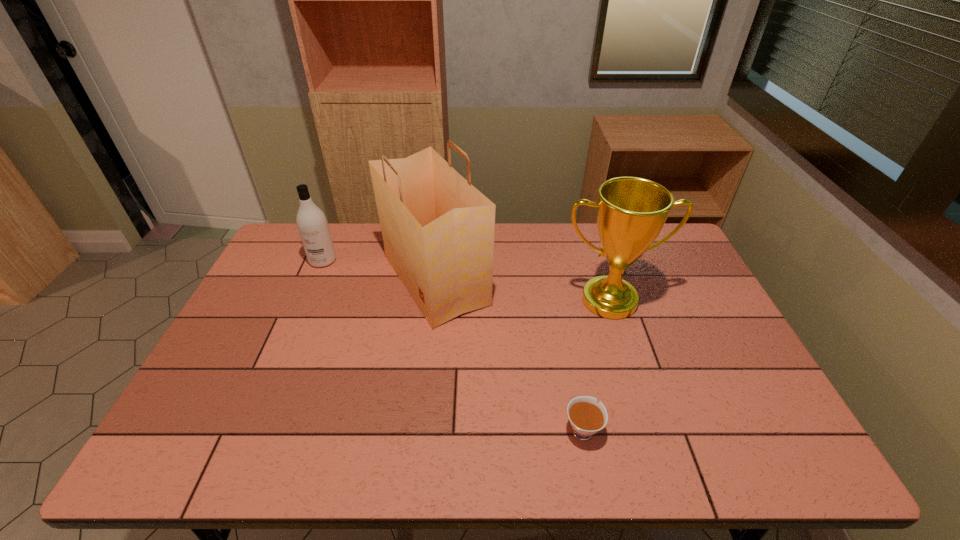
Image resolution: width=960 pixels, height=540 pixels. In the image, there is a desktop. What are the coordinates of `vacant space at the left edge` in the screenshot? It's located at (242, 325).

Where is `free space at the right edge of the desktop`? free space at the right edge of the desktop is located at coordinates (689, 280).

The height and width of the screenshot is (540, 960). In the image, there is a desktop. What are the coordinates of `vacant space at the far right corner` in the screenshot? It's located at [x=676, y=255].

Identify the location of vacant space that is in between the nearest object and the second object from left to right. Image resolution: width=960 pixels, height=540 pixels. (509, 354).

You are a GUI agent. You are given a task and a screenshot of the screen. Output one action in this format:
    pyautogui.click(x=<x>, y=<y>)
    Task: Click on the free point between the grocery bag and the award
    
    Given the screenshot: What is the action you would take?
    pyautogui.click(x=522, y=290)

At what (x,y) coordinates should I click in order to perform the action: click on vacant area that lies between the nearest object and the third shortest object. Please return your answer as a coordinate pair (x, y). The image size is (960, 540). Looking at the image, I should click on (595, 364).

Find the location of `free spot between the shampoo and the shortest object`. free spot between the shampoo and the shortest object is located at coordinates (452, 345).

You are a GUI agent. You are given a task and a screenshot of the screen. Output one action in this format:
    pyautogui.click(x=<x>, y=<y>)
    Task: Click on the free space between the shampoo and the shortest object
    The height and width of the screenshot is (540, 960).
    Given the screenshot: What is the action you would take?
    pyautogui.click(x=452, y=345)

At what (x,y) coordinates should I click in order to perform the action: click on free space between the teacup and the shampoo. Please return your answer as a coordinate pair (x, y). This screenshot has width=960, height=540. Looking at the image, I should click on (452, 345).

Select which object is the closest to the grocery bag. Please provide its 2D coordinates. Your answer should be formatted as a tuple, i.e. [(x, y)], where the tuple contains the x and y coordinates of a point satisfying the conditions above.

[(313, 228)]